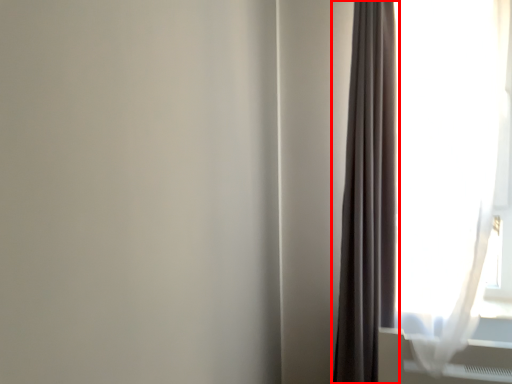
Question: From the image's perspective, considering the relative positions of curtain (annotated by the red box) and curtain in the image provided, where is curtain (annotated by the red box) located with respect to the staircase?

Choices:
 (A) below
 (B) above

Answer: (B)